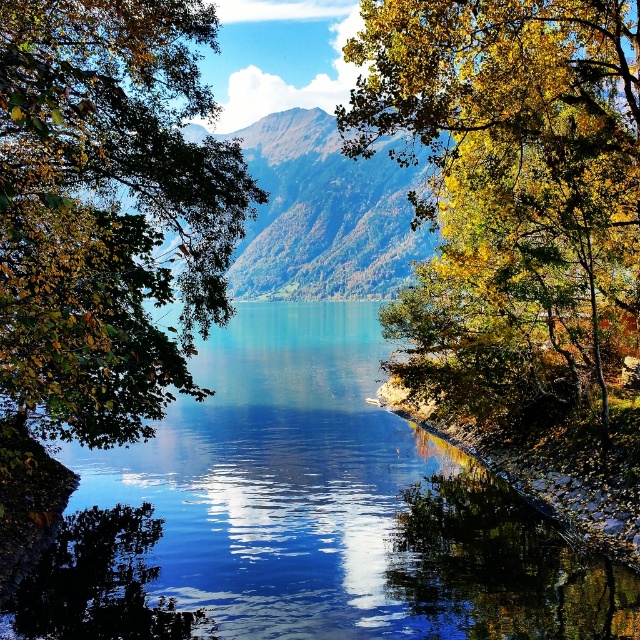
You are standing at the center of the lakeside and see the point marked as point (106, 212). Which direction should you walk to reach the green leafy tree at left?

The point (106, 212) indicates the green leafy tree at left, so you should walk towards the left direction to reach it.